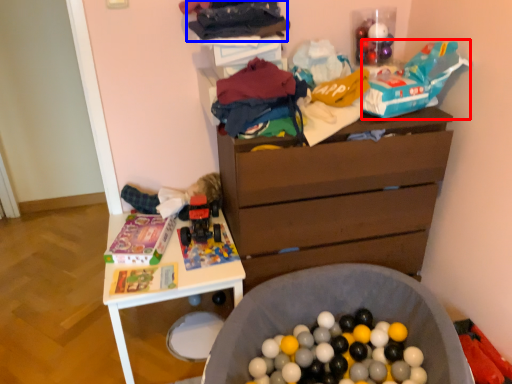
Question: Which object appears closest to the camera in this image, toy (highlighted by a red box) or clothing (highlighted by a blue box)?

Choices:
 (A) toy
 (B) clothing

Answer: (B)